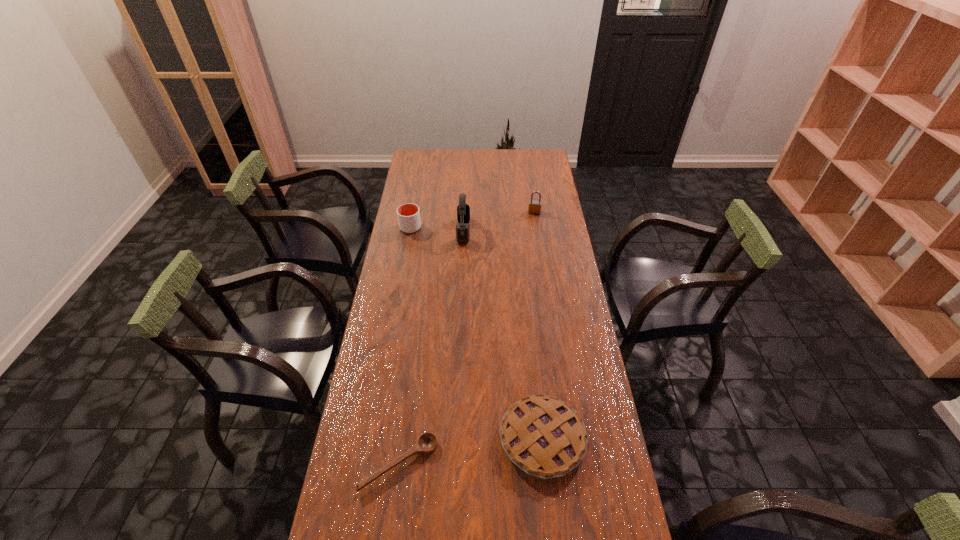
You are a GUI agent. You are given a task and a screenshot of the screen. Output one action in this format:
    pyautogui.click(x=<x>, y=<y>)
    Task: Click on the vacant space situated 0.090m on the left of the second shortest object
    
    Given the screenshot: What is the action you would take?
    pyautogui.click(x=468, y=439)

At what (x,y) coordinates should I click in order to perform the action: click on free spot located on the right of the wooden spoon. Please return your answer as a coordinate pair (x, y). This screenshot has height=540, width=960. Looking at the image, I should click on (511, 464).

This screenshot has height=540, width=960. I want to click on cup located at the left edge, so click(x=408, y=214).

This screenshot has width=960, height=540. I want to click on wooden spoon positioned at the left edge, so click(x=426, y=444).

The width and height of the screenshot is (960, 540). I want to click on padlock that is at the right edge, so pyautogui.click(x=534, y=207).

This screenshot has height=540, width=960. Identify the location of pie present at the right edge. (542, 435).

In the image, there is a desktop. Where is `vacant space at the left edge`? Image resolution: width=960 pixels, height=540 pixels. vacant space at the left edge is located at coordinates (395, 253).

This screenshot has height=540, width=960. I want to click on vacant space at the right edge, so click(596, 375).

At what (x,y) coordinates should I click in order to perform the action: click on vacant space at the far left corner of the desktop. Please return your answer as a coordinate pair (x, y). This screenshot has width=960, height=540. Looking at the image, I should click on (416, 167).

Where is `free point at the far right corner`? free point at the far right corner is located at coordinates (552, 173).